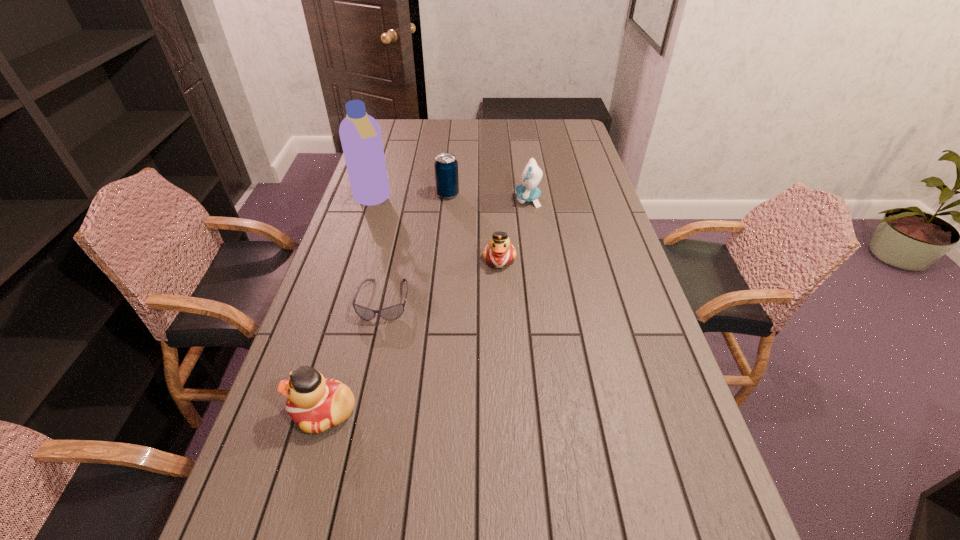
Locate an element on the screen. This screenshot has width=960, height=540. vacant area situated 0.250m on the front of the fourth object from left to right is located at coordinates (443, 244).

What are the coordinates of `vacant region located on the face of the kitten` in the screenshot? It's located at (414, 200).

Locate an element on the screen. Image resolution: width=960 pixels, height=540 pixels. vacant region located 0.210m on the face of the kitten is located at coordinates tap(457, 200).

Find the location of a particular element. The image size is (960, 540). free space located 0.080m on the face of the kitten is located at coordinates (493, 200).

This screenshot has height=540, width=960. Identify the location of free space located 0.350m on the right of the shampoo. (488, 200).

Identify the location of vacant space situated 0.080m on the lenses of the shortest object. (373, 347).

Where is `duck that is at the left edge`? duck that is at the left edge is located at coordinates pyautogui.click(x=316, y=404).

Image resolution: width=960 pixels, height=540 pixels. What are the coordinates of `shampoo located at the left edge` in the screenshot? It's located at (360, 134).

Image resolution: width=960 pixels, height=540 pixels. I want to click on sunglasses present at the left edge, so click(x=393, y=312).

Locate an element on the screen. The height and width of the screenshot is (540, 960). free space at the far edge of the desktop is located at coordinates (499, 122).